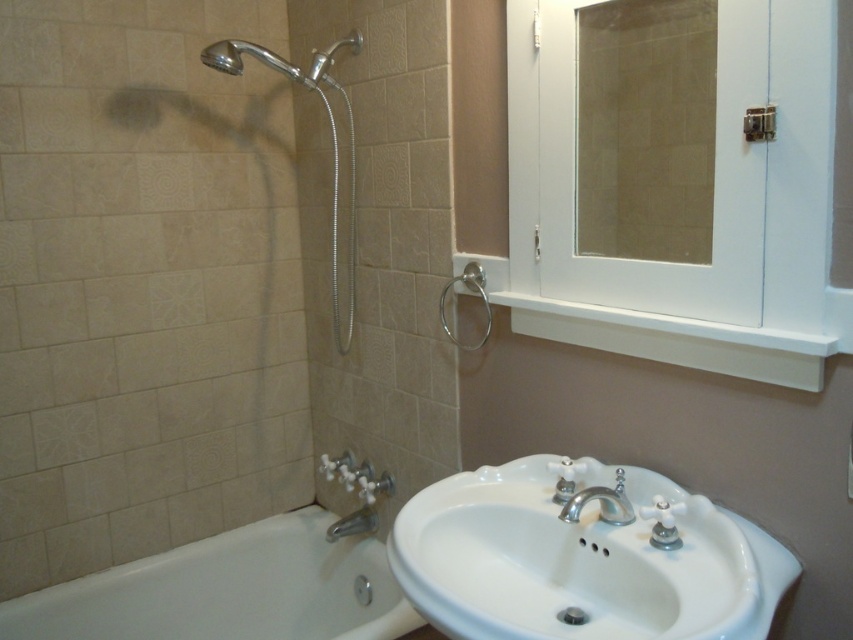
Question: Considering the relative positions of white glossy bathtub at lower left and polished chrome faucet at sink center in the image provided, where is white glossy bathtub at lower left located with respect to polished chrome faucet at sink center?

Choices:
 (A) right
 (B) left

Answer: (B)

Question: Can you confirm if chrome/metallic shower head at upper left is wider than brushed metal shower head at upper left?

Choices:
 (A) yes
 (B) no

Answer: (A)

Question: Among these objects, which one is nearest to the camera?

Choices:
 (A) silver metallic shower head at upper left
 (B) brushed metal shower head at upper left

Answer: (A)

Question: Which point is closer to the camera?

Choices:
 (A) (521, 576)
 (B) (349, 337)
 (C) (22, 625)
 (D) (575, 192)

Answer: (A)

Question: Can you confirm if white porcelain sink at lower right is smaller than brushed metal shower head at upper left?

Choices:
 (A) no
 (B) yes

Answer: (A)

Question: Which point appears closest to the camera in this image?

Choices:
 (A) (331, 49)
 (B) (624, 516)

Answer: (B)